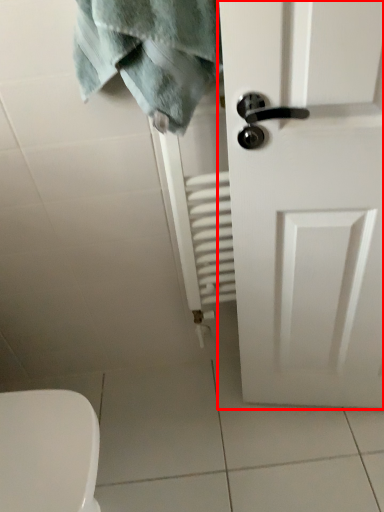
Question: From the image's perspective, where is door (annotated by the red box) located in relation to bath towel in the image?

Choices:
 (A) above
 (B) below

Answer: (B)